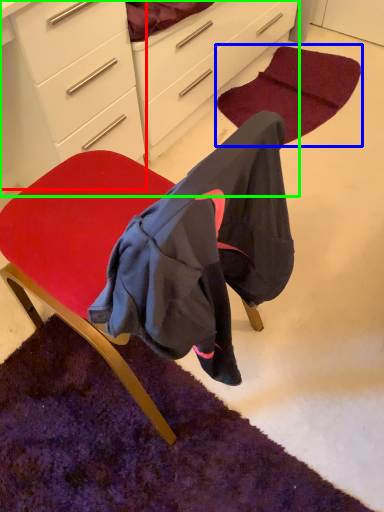
Question: Considering the real-world distances, which object is closest to chest of drawers (highlighted by a red box)? mat (highlighted by a blue box) or cabinetry (highlighted by a green box).

Choices:
 (A) mat
 (B) cabinetry

Answer: (B)